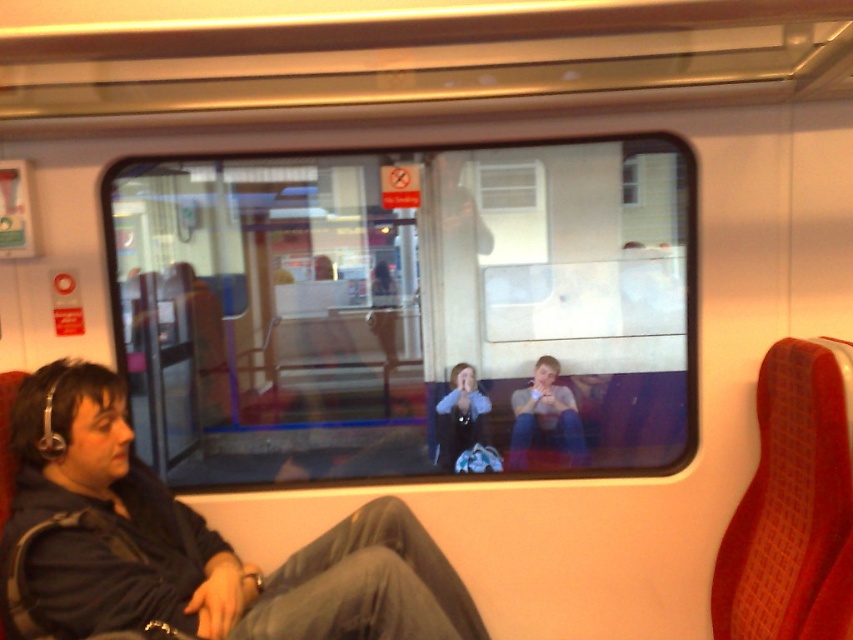
Question: Estimate the real-world distances between objects in this image. Which object is farther from the dark gray fabric coach at lower left?

Choices:
 (A) blue denim jacket at center
 (B) clear glass window at center

Answer: (A)

Question: Is dark gray fabric coach at lower left wider than blue denim jacket at center?

Choices:
 (A) no
 (B) yes

Answer: (B)

Question: Which of the following is the closest to the observer?

Choices:
 (A) (21, 628)
 (B) (473, 376)
 (C) (213, 332)

Answer: (A)

Question: Which point is farther to the camera?

Choices:
 (A) clear glass window at center
 (B) dark gray fabric coach at lower left

Answer: (A)

Question: In this image, where is dark gray fabric coach at lower left located relative to blue denim jacket at center?

Choices:
 (A) right
 (B) left

Answer: (B)

Question: Does clear glass window at center come behind blue denim jacket at center?

Choices:
 (A) no
 (B) yes

Answer: (A)